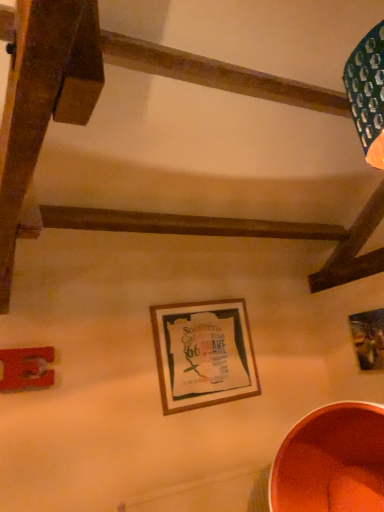
Question: From a real-world perspective, is wooden picture frame at center, which is the 2th picture frame from left to right, located beneath metallic copper basin at lower right?

Choices:
 (A) no
 (B) yes

Answer: (A)

Question: From the image's perspective, does wooden picture frame at center, which is the 2th picture frame from left to right, appear lower than metallic copper basin at lower right?

Choices:
 (A) yes
 (B) no

Answer: (B)

Question: From a real-world perspective, is wooden picture frame at center, which appears as the second picture frame when viewed from the right, on metallic copper basin at lower right?

Choices:
 (A) no
 (B) yes

Answer: (B)

Question: Is wooden picture frame at center, which appears as the second picture frame when viewed from the right, directly adjacent to metallic copper basin at lower right?

Choices:
 (A) yes
 (B) no

Answer: (B)

Question: From the image's perspective, is wooden picture frame at center, which is the 2th picture frame from left to right, above metallic copper basin at lower right?

Choices:
 (A) yes
 (B) no

Answer: (A)

Question: Is wooden picture frame at center, which appears as the second picture frame when viewed from the right, oriented towards metallic copper basin at lower right?

Choices:
 (A) no
 (B) yes

Answer: (A)

Question: From the image's perspective, is metallic copper basin at lower right under wooden picture frame at center, which is the 2th picture frame from left to right?

Choices:
 (A) yes
 (B) no

Answer: (A)

Question: Is metallic copper basin at lower right bigger than wooden picture frame at center, which is the 2th picture frame from left to right?

Choices:
 (A) yes
 (B) no

Answer: (A)

Question: Does metallic copper basin at lower right have a smaller size compared to wooden picture frame at center, which appears as the second picture frame when viewed from the right?

Choices:
 (A) yes
 (B) no

Answer: (B)

Question: Could you tell me if metallic copper basin at lower right is facing wooden picture frame at center, which appears as the second picture frame when viewed from the right?

Choices:
 (A) no
 (B) yes

Answer: (A)

Question: Is metallic copper basin at lower right turned away from wooden picture frame at center, which is the 2th picture frame from left to right?

Choices:
 (A) yes
 (B) no

Answer: (B)

Question: Is metallic copper basin at lower right at the right side of wooden picture frame at center, which appears as the second picture frame when viewed from the right?

Choices:
 (A) yes
 (B) no

Answer: (A)

Question: Considering the relative sizes of wooden picture frame at upper right, placed as the 1th picture frame when sorted from right to left, and metallic copper basin at lower right in the image provided, is wooden picture frame at upper right, placed as the 1th picture frame when sorted from right to left, shorter than metallic copper basin at lower right?

Choices:
 (A) no
 (B) yes

Answer: (B)